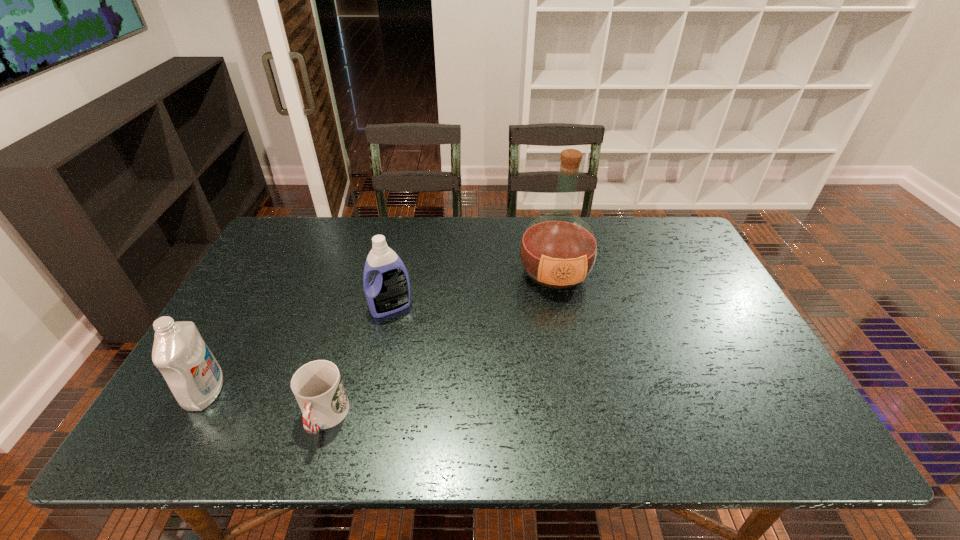
What are the coordinates of `the rightmost object` in the screenshot? It's located at pyautogui.click(x=558, y=250).

At what (x,y) coordinates should I click in order to perform the action: click on liquor. Please return your answer as a coordinate pair (x, y). Looking at the image, I should click on (558, 250).

Find the location of a particular element. the left detergent is located at coordinates (195, 378).

Locate an element on the screen. This screenshot has height=540, width=960. the leftmost object is located at coordinates (195, 378).

The height and width of the screenshot is (540, 960). Find the location of `the farther detergent`. the farther detergent is located at coordinates (389, 291).

Locate an element on the screen. Image resolution: width=960 pixels, height=540 pixels. the shortest object is located at coordinates (318, 388).

Where is `vacant space located 0.280m on the front label of the liquor`? This screenshot has width=960, height=540. vacant space located 0.280m on the front label of the liquor is located at coordinates (x=576, y=383).

Locate an element on the screen. vacant space located 0.250m on the right of the leftmost object is located at coordinates (330, 392).

Find the location of a particular element. free space located 0.340m on the left of the right detergent is located at coordinates (248, 307).

Find the location of a particular element. object that is at the far edge is located at coordinates (558, 250).